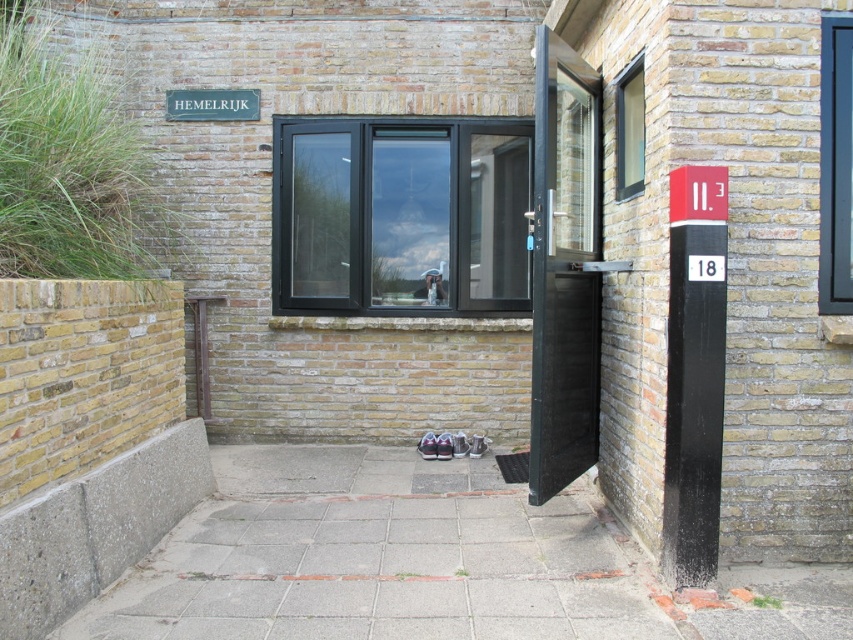
Does black glass door at center have a greater width compared to black matte pole at right?

Correct, the width of black glass door at center exceeds that of black matte pole at right.

Find the location of a particular element. black glass door at center is located at coordinates (564, 268).

This screenshot has height=640, width=853. I want to click on gray concrete pavement at lower center, so click(376, 557).

From the picture: Can you confirm if gray concrete pavement at lower center is positioned below black matte pole at right?

Yes.

This screenshot has height=640, width=853. Describe the element at coordinates (376, 557) in the screenshot. I see `gray concrete pavement at lower center` at that location.

At what (x,y) coordinates should I click in order to perform the action: click on gray concrete pavement at lower center. Please return your answer as a coordinate pair (x, y). Looking at the image, I should click on (376, 557).

Can you confirm if black glass window at center is positioned to the right of black glass window at upper right?

Incorrect, black glass window at center is not on the right side of black glass window at upper right.

Between point (413, 189) and point (848, 177), which one is positioned in front?

Point (848, 177) is more forward.

Find the location of `black glass window at center`. black glass window at center is located at coordinates (399, 216).